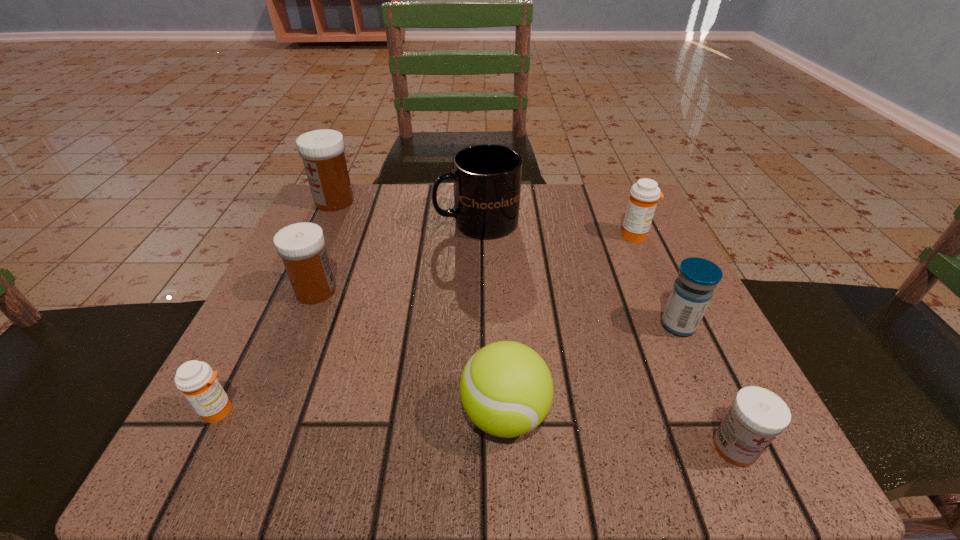
Locate an element on the screen. The width and height of the screenshot is (960, 540). free region located 0.170m on the left of the tennis ball is located at coordinates (334, 414).

The image size is (960, 540). Identify the location of blank space located on the left of the third nearest medicine. (592, 325).

This screenshot has height=540, width=960. I want to click on vacant space located on the right of the left orange medicine, so click(x=295, y=410).

At what (x,y) coordinates should I click in order to perform the action: click on vacant area situated on the left of the smallest white medicine. Please return your answer as a coordinate pair (x, y). Looking at the image, I should click on (610, 447).

Identify the location of mug located at the far edge. (487, 178).

You are a GUI agent. You are given a task and a screenshot of the screen. Output one action in this format:
    pyautogui.click(x=<x>, y=<y>)
    Task: Click on the tennis ball that is at the near edge
    Image resolution: width=960 pixels, height=540 pixels.
    Given the screenshot: What is the action you would take?
    pyautogui.click(x=506, y=389)

Identify the location of object that is at the far left corner. This screenshot has width=960, height=540. (322, 151).

Where is `object positioned at the near left corner`? Image resolution: width=960 pixels, height=540 pixels. object positioned at the near left corner is located at coordinates (197, 381).

The height and width of the screenshot is (540, 960). I want to click on object that is at the far right corner, so click(x=643, y=198).

The height and width of the screenshot is (540, 960). I want to click on object located in the near right corner section of the desktop, so click(x=758, y=415).